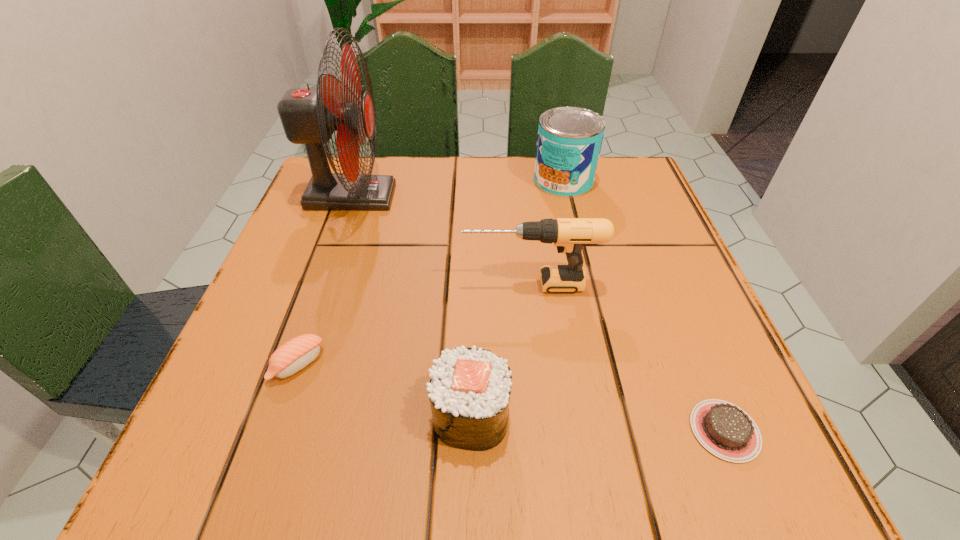
You are a GUI agent. You are given a task and a screenshot of the screen. Output one action in this format:
    pyautogui.click(x=<x>, y=<y>)
    Task: Click on the chocolate cake located at the near edge
    Image resolution: width=960 pixels, height=540 pixels.
    Given the screenshot: What is the action you would take?
    pyautogui.click(x=724, y=429)

In order to click on fan located in the left edge section of the desktop in this screenshot , I will do `click(309, 116)`.

You are a GUI agent. You are given a task and a screenshot of the screen. Output one action in this format:
    pyautogui.click(x=<x>, y=<y>)
    Task: Click on the sushi present at the left edge
    
    Given the screenshot: What is the action you would take?
    pyautogui.click(x=294, y=355)

Where is `can at the right edge`? The height and width of the screenshot is (540, 960). can at the right edge is located at coordinates (569, 141).

This screenshot has height=540, width=960. In order to click on chocolate cake that is positioned at the right edge in this screenshot , I will do `click(724, 429)`.

What are the coordinates of `object that is at the far left corner` in the screenshot? It's located at (309, 116).

Identify the location of object that is at the far right corner. The height and width of the screenshot is (540, 960). (569, 141).

This screenshot has height=540, width=960. Identify the location of object that is at the near right corner. 724,429.

Where is `blank space at the far edge of the desktop`? This screenshot has width=960, height=540. blank space at the far edge of the desktop is located at coordinates (472, 213).

The height and width of the screenshot is (540, 960). I want to click on free location at the near edge, so click(533, 417).